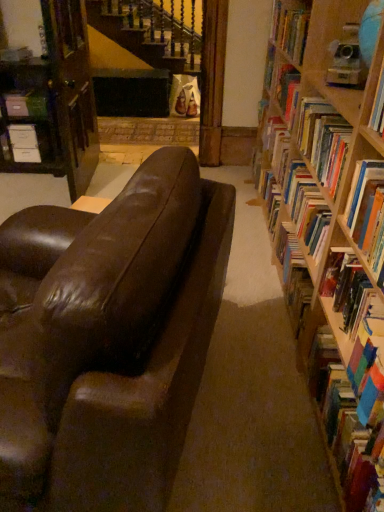
What do you see at coordinates (323, 141) in the screenshot? I see `hardcover book at right, which is the 3th book from bottom to top` at bounding box center [323, 141].

What do you see at coordinates (29, 119) in the screenshot? I see `matte black file cabinet at left` at bounding box center [29, 119].

The width and height of the screenshot is (384, 512). In order to click on hardcover book at right, arranged as the first book when viewed from the front in this screenshot , I will do `click(363, 198)`.

The image size is (384, 512). Describe the element at coordinates (108, 338) in the screenshot. I see `shiny brown leather couch at center` at that location.

This screenshot has width=384, height=512. In order to click on shiny brown leather couch at center in this screenshot , I will do [108, 338].

Where is `hardcover book at right, which is the 3th book from bottom to top`? This screenshot has height=512, width=384. hardcover book at right, which is the 3th book from bottom to top is located at coordinates [323, 141].

At what (x,y) coordinates should I click in order to perform the action: click on book above the wooden bookcase at left (from the image's perspective). Please return your answer as a coordinate pair (x, y). Looking at the image, I should click on (290, 28).

Can you see wooden bookcase at left touching hardcover book at upper right, which is the first book from top to bottom?

No, wooden bookcase at left is not next to hardcover book at upper right, which is the first book from top to bottom.

Considering the relative sizes of wooden bookcase at left and hardcover book at upper right, the 4th book in the front-to-back sequence, in the image provided, is wooden bookcase at left taller than hardcover book at upper right, the 4th book in the front-to-back sequence,?

Correct, wooden bookcase at left is much taller as hardcover book at upper right, the 4th book in the front-to-back sequence.

Does point (44, 72) come farther from viewer compared to point (292, 41)?

Yes, point (44, 72) is behind point (292, 41).

From the picture: Would you say hardcover book at right, arranged as the first book when viewed from the front, is inside or outside multicolored paperbacks at right, the third book positioned from the back?

The correct answer is: outside.

Are hardcover book at right, which is counted as the third book, starting from the top, and multicolored paperbacks at right, the first book positioned from the bottom, making contact?

hardcover book at right, which is counted as the third book, starting from the top, and multicolored paperbacks at right, the first book positioned from the bottom, are clearly separated.

Is hardcover book at right, placed as the 2th book when sorted from bottom to top, looking in the opposite direction of multicolored paperbacks at right, the second book in the front-to-back sequence?

No, multicolored paperbacks at right, the second book in the front-to-back sequence, is not at the back of hardcover book at right, placed as the 2th book when sorted from bottom to top.

Does hardcover book at right, arranged as the first book when viewed from the front, have a greater height compared to multicolored paperbacks at right, the third book positioned from the back?

Yes, hardcover book at right, arranged as the first book when viewed from the front, is taller than multicolored paperbacks at right, the third book positioned from the back.

Who is more distant, hardcover book at right, arranged as the first book when viewed from the front, or hardcover book at right, acting as the 2th book starting from the back?

hardcover book at right, acting as the 2th book starting from the back, is behind.

Is hardcover book at right, placed as the 2th book when sorted from bottom to top, wider than hardcover book at right, marked as the second book in a top-to-bottom arrangement?

Incorrect, the width of hardcover book at right, placed as the 2th book when sorted from bottom to top, does not surpass that of hardcover book at right, marked as the second book in a top-to-bottom arrangement.

There is a hardcover book at right, which is the 3th book from bottom to top. Identify the location of the 1st book above it (from a real-world perspective). This screenshot has height=512, width=384. (363, 198).

From the picture: Which object is positioned more to the left, hardcover book at right, arranged as the first book when viewed from the front, or hardcover book at right, which is the 3th book from bottom to top?

hardcover book at right, arranged as the first book when viewed from the front.

Could you tell me if multicolored paperbacks at right, the first book positioned from the bottom, is turned towards hardcover book at right, placed as the 2th book when sorted from bottom to top?

No.

Is point (329, 459) positioned before point (378, 168)?

No, it is not.

Measure the distance from multicolored paperbacks at right, the second book in the front-to-back sequence, to hardcover book at right, which is the 4th book from back to front.

The distance of multicolored paperbacks at right, the second book in the front-to-back sequence, from hardcover book at right, which is the 4th book from back to front, is 17.94 inches.

From the image's perspective, is multicolored paperbacks at right, positioned as the 4th book in top-to-bottom order, positioned above or below hardcover book at right, arranged as the first book when viewed from the front?

multicolored paperbacks at right, positioned as the 4th book in top-to-bottom order, is situated lower than hardcover book at right, arranged as the first book when viewed from the front, in the image.

Could you tell me if matte black file cabinet at left is facing hardcover book at upper right, the 4th book in the front-to-back sequence?

No, matte black file cabinet at left is not oriented towards hardcover book at upper right, the 4th book in the front-to-back sequence.

In the scene shown: Measure the distance from matte black file cabinet at left to hardcover book at upper right, the 4th book in the front-to-back sequence.

matte black file cabinet at left and hardcover book at upper right, the 4th book in the front-to-back sequence, are 1.92 meters apart.

From a real-world perspective, is matte black file cabinet at left positioned above or below hardcover book at upper right, which is the first book from top to bottom?

Clearly, from a real-world perspective, matte black file cabinet at left is below hardcover book at upper right, which is the first book from top to bottom.

Is matte black file cabinet at left not inside hardcover book at upper right, which appears as the 1th book when viewed from the back?

Yes.

From the picture: How much distance is there between matte black file cabinet at left and matte white paperback book at center?

25.20 centimeters.

From their relative heights in the image, would you say matte black file cabinet at left is taller or shorter than matte white paperback book at center?

Clearly, matte black file cabinet at left is taller compared to matte white paperback book at center.

Consider the image. From a real-world perspective, which is physically above, matte black file cabinet at left or matte white paperback book at center?

In real-world perspective, matte black file cabinet at left is above.

Could you tell me if matte black file cabinet at left is facing matte white paperback book at center?

Yes.

Does point (372, 468) appear closer or farther from the camera than point (20, 72)?

Clearly, point (372, 468) is closer to the camera than point (20, 72).

Can wooden bookcase at left be found inside multicolored paperbacks at right, the third book positioned from the back?

No, wooden bookcase at left is not a part of multicolored paperbacks at right, the third book positioned from the back.

From the picture: From the image's perspective, is multicolored paperbacks at right, the third book positioned from the back, above or below wooden bookcase at left?

multicolored paperbacks at right, the third book positioned from the back, is below wooden bookcase at left.

Locate an element on the screen. This screenshot has height=512, width=384. bookcase below the hardcover book at upper right, positioned as the 4th book in bottom-to-top order (from the image's perspective) is located at coordinates (52, 95).

At what (x,y) coordinates should I click in order to perform the action: click on book on the left of hardcover book at right, which is the 4th book from back to front. Please return your answer as a coordinate pair (x, y). Looking at the image, I should click on (347, 416).

From the image, which object appears to be nearer to matte white paperback book at center, matte black file cabinet at left or hardcover book at right, arranged as the first book when viewed from the front?

Among the two, matte black file cabinet at left is located nearer to matte white paperback book at center.

In the scene shown: Considering their positions, is matte black file cabinet at left positioned closer to hardcover book at right, arranged as the first book when viewed from the front, than hardcover book at right, which is the 3th book from bottom to top?

Based on the image, hardcover book at right, which is the 3th book from bottom to top, appears to be nearer to hardcover book at right, arranged as the first book when viewed from the front.

Consider the image. From the image, which object appears to be nearer to multicolored paperbacks at right, the first book positioned from the bottom, shiny brown leather couch at center or hardcover book at right, acting as the 2th book starting from the back?

Among the two, shiny brown leather couch at center is located nearer to multicolored paperbacks at right, the first book positioned from the bottom.

When comparing their distances from wooden bookcase at left, does matte white paperback book at center or shiny brown leather couch at center seem closer?

matte white paperback book at center.

From the image, which object appears to be nearer to wooden bookcase at left, hardcover book at right, acting as the 2th book starting from the back, or hardcover book at upper right, which is the first book from top to bottom?

hardcover book at upper right, which is the first book from top to bottom, lies closer to wooden bookcase at left than the other object.

Consider the image. When comparing their distances from matte black file cabinet at left, does hardcover book at upper right, positioned as the 4th book in bottom-to-top order, or hardcover book at right, which is counted as the third book, starting from the top, seem closer?

The object closer to matte black file cabinet at left is hardcover book at upper right, positioned as the 4th book in bottom-to-top order.

Based on their spatial positions, is shiny brown leather couch at center or hardcover book at right, arranged as the first book when viewed from the front, closer to multicolored paperbacks at right, the first book positioned from the bottom?

Among the two, hardcover book at right, arranged as the first book when viewed from the front, is located nearer to multicolored paperbacks at right, the first book positioned from the bottom.

When comparing their distances from matte black file cabinet at left, does multicolored paperbacks at right, the second book in the front-to-back sequence, or hardcover book at upper right, which appears as the 1th book when viewed from the back, seem further?

Among the two, multicolored paperbacks at right, the second book in the front-to-back sequence, is located further to matte black file cabinet at left.

What are the coordinates of `bookcase between shiny brown leather couch at center and matte black file cabinet at left along the z-axis` in the screenshot? It's located at (52, 95).

Locate an element on the screen. bookcase situated between matte white paperback book at center and hardcover book at upper right, positioned as the 4th book in bottom-to-top order, from left to right is located at coordinates (52, 95).

You are a GUI agent. You are given a task and a screenshot of the screen. Output one action in this format:
    pyautogui.click(x=<x>, y=<y>)
    Task: Click on the shelf between wooden bookcase at left and matte white paperback book at center from front to back
    
    Given the screenshot: What is the action you would take?
    pyautogui.click(x=29, y=119)

Find the location of a particular element. paperback book situated between matte black file cabinet at left and hardcover book at upper right, the 4th book in the front-to-back sequence, from left to right is located at coordinates (26, 155).